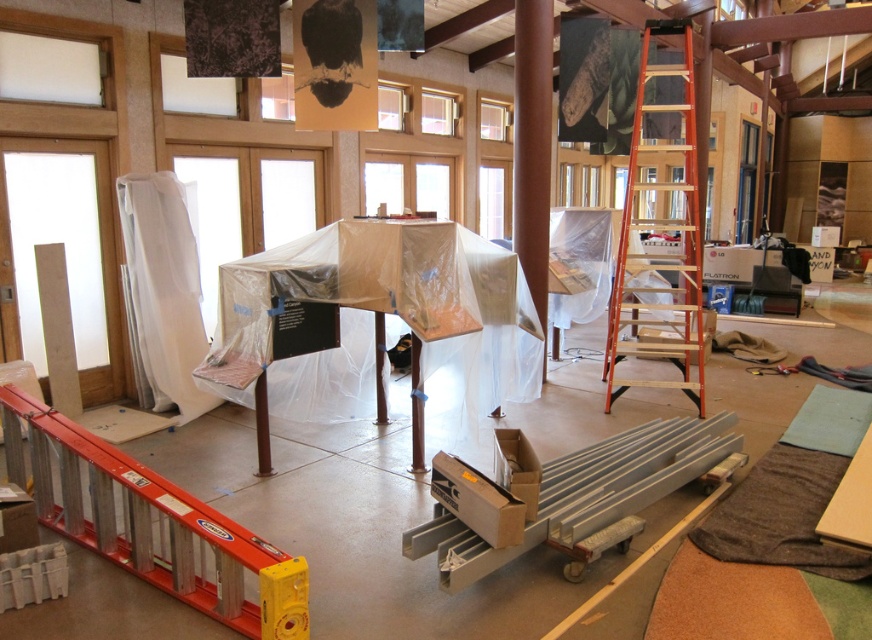
Question: Which object appears farthest from the camera in this image?

Choices:
 (A) orange aluminum ladder at right
 (B) aluminum ladder at lower left

Answer: (A)

Question: Which of the following is the farthest from the observer?

Choices:
 (A) orange aluminum ladder at right
 (B) aluminum ladder at lower left

Answer: (A)

Question: Is aluminum ladder at lower left thinner than orange aluminum ladder at right?

Choices:
 (A) no
 (B) yes

Answer: (A)

Question: Which object is farther from the camera taking this photo?

Choices:
 (A) orange aluminum ladder at right
 (B) aluminum ladder at lower left

Answer: (A)

Question: Is aluminum ladder at lower left positioned at the back of orange aluminum ladder at right?

Choices:
 (A) no
 (B) yes

Answer: (A)

Question: Where is aluminum ladder at lower left located in relation to orange aluminum ladder at right in the image?

Choices:
 (A) below
 (B) above

Answer: (A)